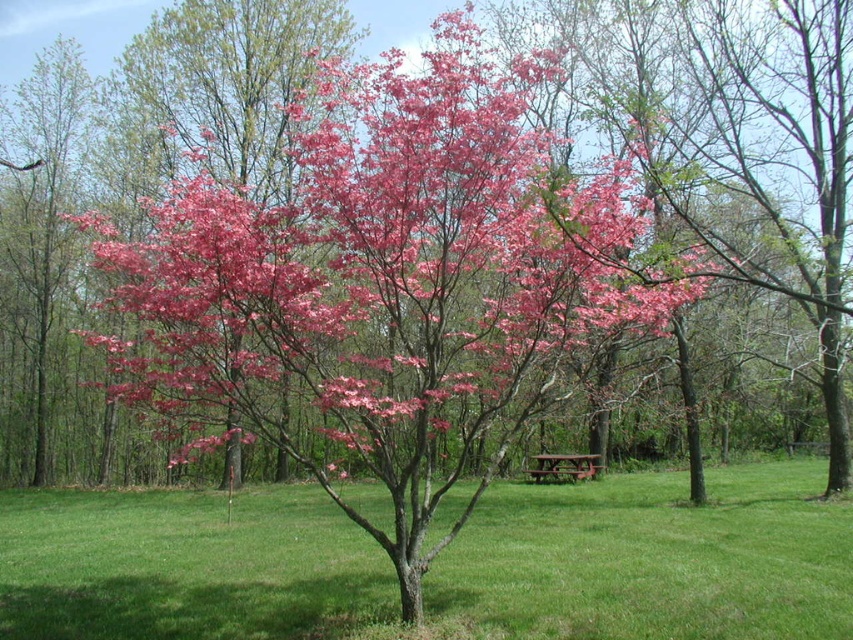
Measure the distance between green grass at center and camera.

A distance of 5.28 meters exists between green grass at center and camera.

Does green grass at center appear on the left side of pink matte tree at left?

In fact, green grass at center is to the right of pink matte tree at left.

In the scene shown: Who is more forward, (122, 621) or (21, 269)?

Positioned in front is point (122, 621).

Identify the location of green grass at center. (653, 561).

Does point (741, 586) come in front of point (540, 461)?

That is True.

Looking at this image, does green grass at center lie behind wooden park bench at center?

No, green grass at center is in front of wooden park bench at center.

Which is behind, point (566, 490) or point (567, 474)?

Point (567, 474)

The width and height of the screenshot is (853, 640). Find the location of `green grass at center`. green grass at center is located at coordinates (653, 561).

Is pink glossy tree at center to the right of wooden park bench at center from the viewer's perspective?

No, pink glossy tree at center is not to the right of wooden park bench at center.

Is pink glossy tree at center shorter than wooden park bench at center?

No.

You are a GUI agent. You are given a task and a screenshot of the screen. Output one action in this format:
    pyautogui.click(x=<x>, y=<y>)
    Task: Click on the pink glossy tree at center
    
    Given the screenshot: What is the action you would take?
    (234, 81)

Where is `pink glossy tree at center`? pink glossy tree at center is located at coordinates (234, 81).